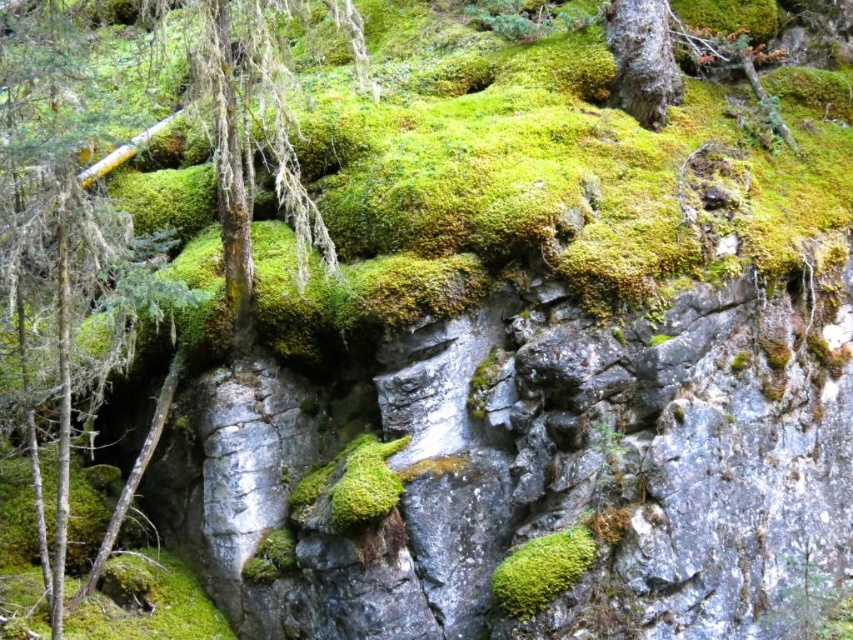
You are an environmental scientist assessing the spread of moss in this natural area. You notice the green mossy tree at upper left and the green mossy bark at upper right. Which of these two objects has a greater width?

The green mossy tree at upper left might be wider than green mossy bark at upper right according to the description.